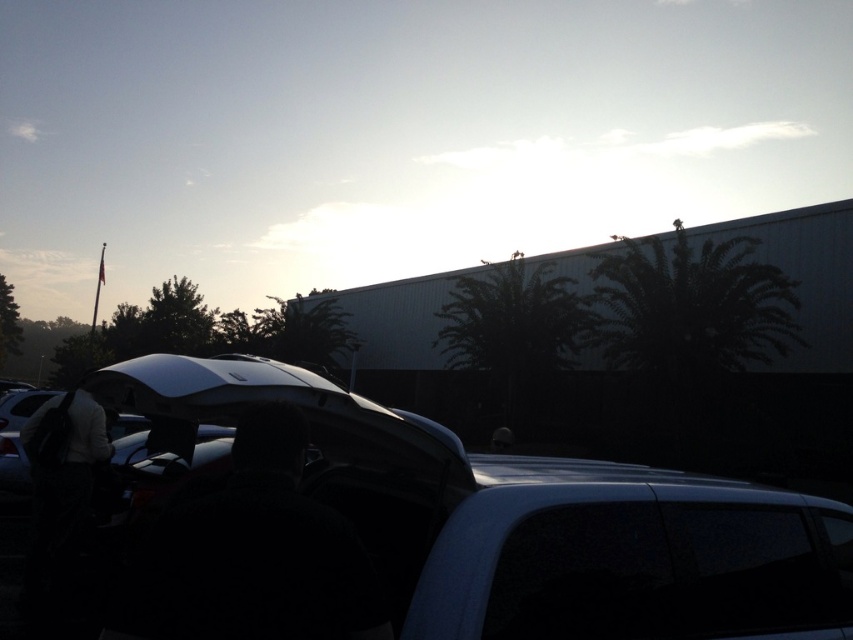
In the scene shown: Which is below, glossy black car at center or black fabric at center?

glossy black car at center is below.

Who is taller, glossy black car at center or black fabric at center?

glossy black car at center is taller.

Looking at this image, who is more distant from viewer, (x=566, y=563) or (x=283, y=435)?

The point (x=566, y=563) is behind.

This screenshot has height=640, width=853. Find the location of `glossy black car at center`. glossy black car at center is located at coordinates (457, 532).